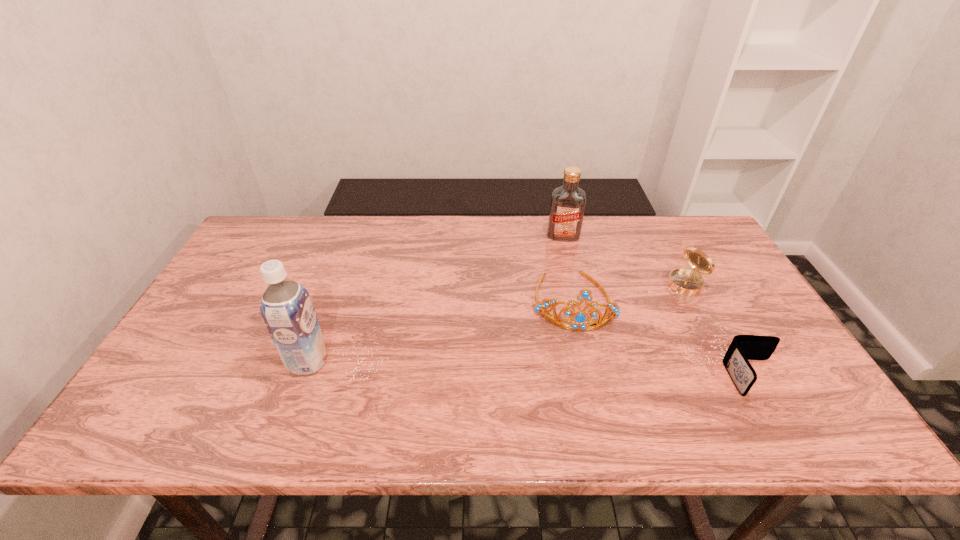
You are a GUI agent. You are given a task and a screenshot of the screen. Output one action in this format:
    pyautogui.click(x=<x>, y=<y>)
    Task: Click on the free space on the desktop that is between the tallest object and the shortest object and is positioned on the front-facing side of the farthest object
    This screenshot has width=960, height=540.
    Given the screenshot: What is the action you would take?
    pyautogui.click(x=562, y=370)

Locate an element on the screen. vacant space on the desktop that is between the soya milk and the shortest object and is positioned on the front-facing side of the third tallest object is located at coordinates (582, 372).

The image size is (960, 540). In order to click on free space on the desktop that is between the soya milk and the shortest object and is positioned with the dial facing the fourth tallest object in this screenshot , I will do click(552, 370).